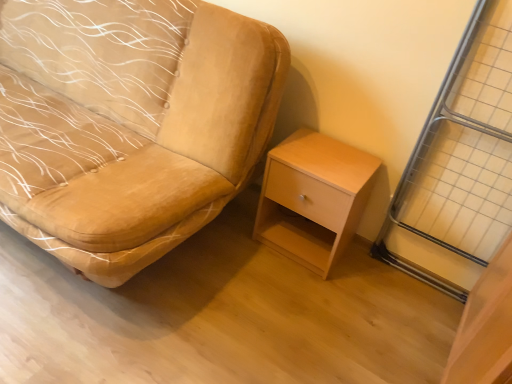
Question: Is light wood/finely finished nightstand at lower right to the left or to the right of metallic silver screen door at right in the image?

Choices:
 (A) left
 (B) right

Answer: (A)

Question: Relative to metallic silver screen door at right, is light wood/finely finished nightstand at lower right in front or behind?

Choices:
 (A) behind
 (B) front

Answer: (A)

Question: Estimate the real-world distances between objects in this image. Which object is farther from the metallic silver screen door at right?

Choices:
 (A) velvet beige chair at center
 (B) light wood/finely finished nightstand at lower right

Answer: (A)

Question: Estimate the real-world distances between objects in this image. Which object is farther from the metallic silver screen door at right?

Choices:
 (A) velvet beige chair at center
 (B) light wood/finely finished nightstand at lower right

Answer: (A)